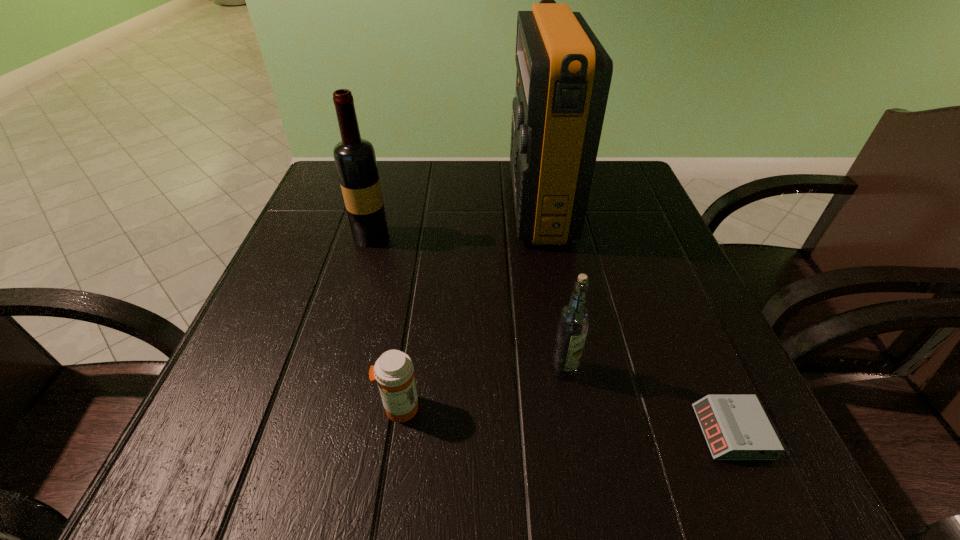
In order to click on free space that satisfies the following two spatial constraints: 1. on the front-facing side of the tallest object; 2. on the label of the third farthest object in this screenshot , I will do `click(568, 369)`.

I want to click on blank area in the image that satisfies the following two spatial constraints: 1. on the front-facing side of the tallest object; 2. on the front side of the wine bottle, so click(545, 237).